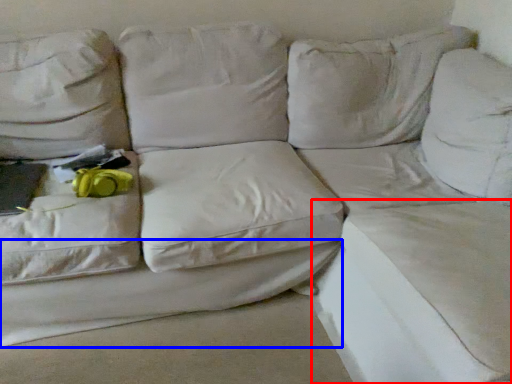
Question: Which object appears closest to the camera in this image, sheet (highlighted by a red box) or sheet (highlighted by a blue box)?

Choices:
 (A) sheet
 (B) sheet

Answer: (A)